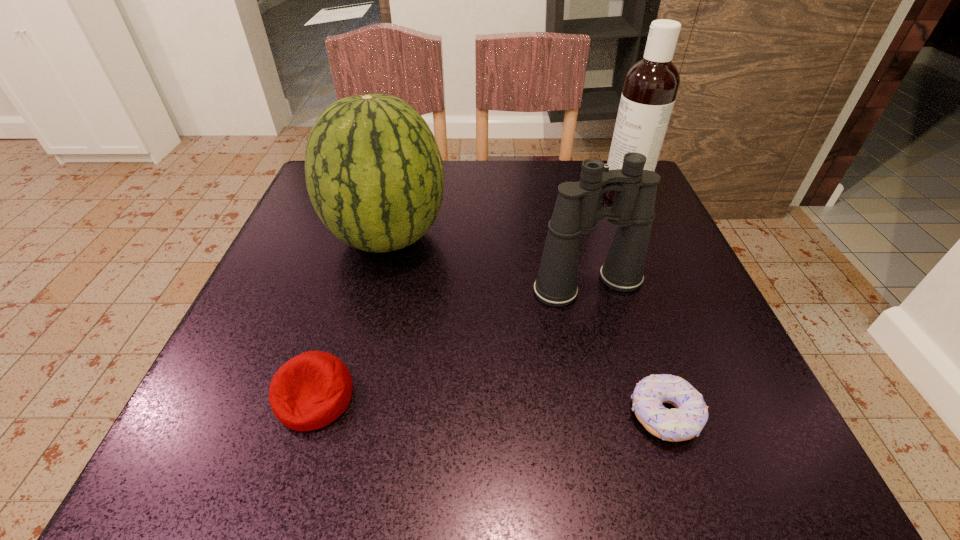
Find the location of a particular element. The height and width of the screenshot is (540, 960). vacant point located between the watermelon and the shortest object is located at coordinates (525, 326).

Find the location of a particular element. free area in between the beanbag and the watermelon is located at coordinates (351, 317).

This screenshot has height=540, width=960. I want to click on free spot between the tallest object and the beanbag, so click(x=469, y=295).

I want to click on free area in between the second shortest object and the tallest object, so click(469, 295).

Find the location of a particular element. The image size is (960, 540). vacant area that lies between the binoculars and the watermelon is located at coordinates (488, 261).

Find the location of `free spot between the tallest object and the watermelon`. free spot between the tallest object and the watermelon is located at coordinates (505, 215).

Locate an element on the screen. The image size is (960, 540). free space between the beanbag and the watermelon is located at coordinates (351, 317).

Find the location of `vacant area that lies between the watermelon and the binoculars`. vacant area that lies between the watermelon and the binoculars is located at coordinates (488, 261).

Identify which object is located as the fourth nearest to the dishwasher detergent. Please provide its 2D coordinates. Your answer should be formatted as a tuple, i.e. [(x, y)], where the tuple contains the x and y coordinates of a point satisfying the conditions above.

[(311, 390)]

Identify which object is located as the nearest to the beanbag. Please provide its 2D coordinates. Your answer should be formatted as a tuple, i.e. [(x, y)], where the tuple contains the x and y coordinates of a point satisfying the conditions above.

[(374, 173)]